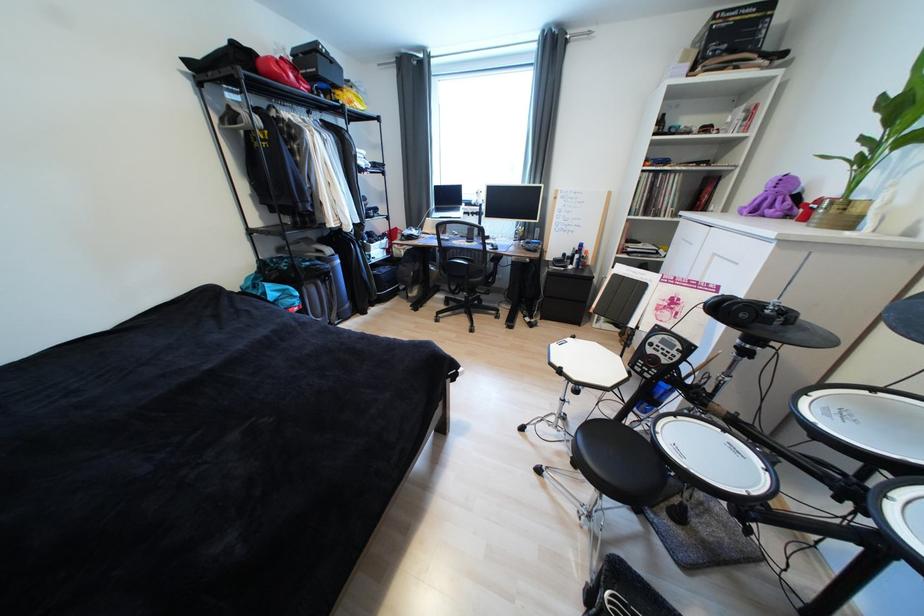
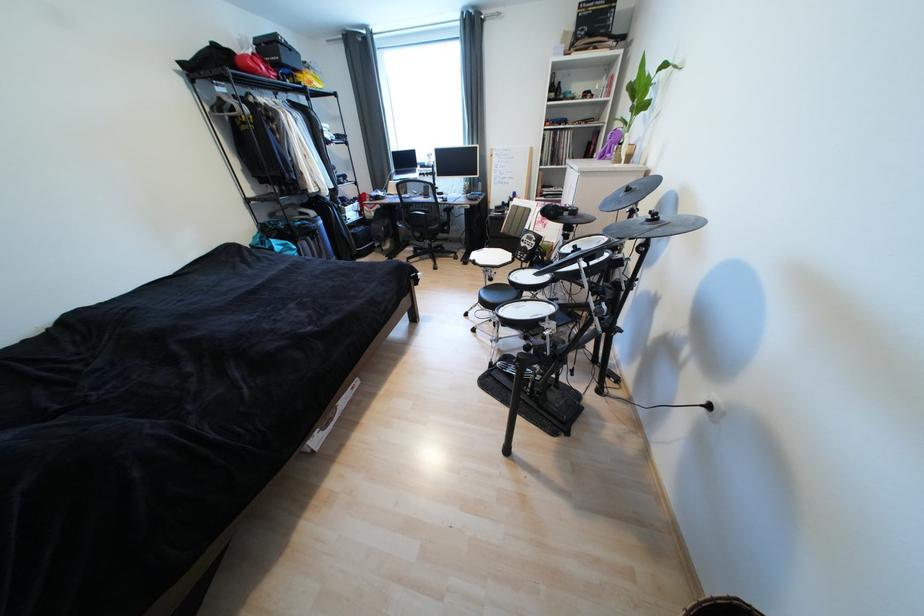
The point at (517, 325) is marked in the first image. Where is the corresponding point in the second image?

(472, 262)